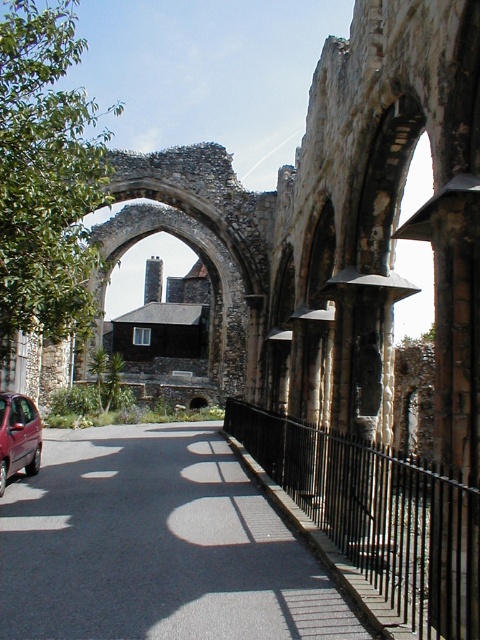
Question: Among these objects, which one is farthest from the camera?

Choices:
 (A) black asphalt road at center
 (B) metallic maroon car at lower left

Answer: (B)

Question: Can you confirm if black asphalt road at center is wider than metallic maroon car at lower left?

Choices:
 (A) no
 (B) yes

Answer: (B)

Question: Is black asphalt road at center in front of metallic maroon car at lower left?

Choices:
 (A) yes
 (B) no

Answer: (A)

Question: In this image, where is black asphalt road at center located relative to metallic maroon car at lower left?

Choices:
 (A) left
 (B) right

Answer: (B)

Question: Which of the following is the farthest from the observer?

Choices:
 (A) black asphalt road at center
 (B) metallic maroon car at lower left

Answer: (B)

Question: Which point is closer to the camera taking this photo?

Choices:
 (A) (136, 480)
 (B) (13, 404)

Answer: (B)